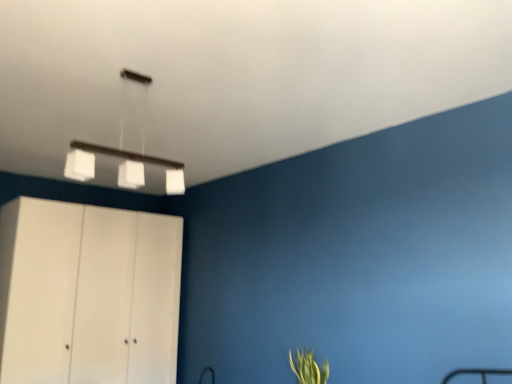
Measure the distance between point (x=169, y=183) and camera.

A distance of 2.15 meters exists between point (x=169, y=183) and camera.

This screenshot has height=384, width=512. What do you see at coordinates (88, 294) in the screenshot? I see `white matte cabinet at left` at bounding box center [88, 294].

The height and width of the screenshot is (384, 512). I want to click on green leafy plant at lower right, so click(309, 368).

Considering the sizes of objects white matte cabinet at left and white matte rectangular light fixture at upper center in the image provided, who is smaller, white matte cabinet at left or white matte rectangular light fixture at upper center?

white matte rectangular light fixture at upper center.

From the image's perspective, is white matte cabinet at left above white matte rectangular light fixture at upper center?

No, from the image's perspective, white matte cabinet at left is not above white matte rectangular light fixture at upper center.

Who is shorter, white matte cabinet at left or white matte rectangular light fixture at upper center?

white matte rectangular light fixture at upper center.

From a real-world perspective, who is located lower, white matte cabinet at left or white matte rectangular light fixture at upper center?

In real-world perspective, white matte cabinet at left is lower.

From the image's perspective, is white matte rectangular light fixture at upper center located above or below white matte cabinet at left?

white matte rectangular light fixture at upper center is situated higher than white matte cabinet at left in the image.

Which object is further away from the camera taking this photo, white matte rectangular light fixture at upper center or white matte cabinet at left?

white matte cabinet at left.

Find the location of a particular element. cupboard below the white matte rectangular light fixture at upper center (from the image's perspective) is located at coordinates (88, 294).

Would you say white matte rectangular light fixture at upper center contains white matte cabinet at left?

No, white matte rectangular light fixture at upper center does not contain white matte cabinet at left.

Is green leafy plant at lower right far from white matte cabinet at left?

Yes, green leafy plant at lower right and white matte cabinet at left are located far from each other.

What are the coordinates of `cupboard that appears above the green leafy plant at lower right (from the image's perspective)` in the screenshot? It's located at pos(88,294).

From the image's perspective, between green leafy plant at lower right and white matte cabinet at left, which one is located above?

white matte cabinet at left, from the image's perspective.

Which of these two, green leafy plant at lower right or white matte cabinet at left, is bigger?

With larger size is white matte cabinet at left.

From the image's perspective, is white matte rectangular light fixture at upper center above or below green leafy plant at lower right?

Based on their image positions, white matte rectangular light fixture at upper center is located above green leafy plant at lower right.

Is white matte rectangular light fixture at upper center to the left or to the right of green leafy plant at lower right in the image?

white matte rectangular light fixture at upper center is to the left of green leafy plant at lower right.

Between white matte rectangular light fixture at upper center and green leafy plant at lower right, which one has smaller width?

With smaller width is white matte rectangular light fixture at upper center.

Can you confirm if white matte rectangular light fixture at upper center is taller than green leafy plant at lower right?

Yes.

Can you tell me how much green leafy plant at lower right and white matte rectangular light fixture at upper center differ in facing direction?

The angular difference between green leafy plant at lower right and white matte rectangular light fixture at upper center is 95.3 degrees.

In the scene shown: From the image's perspective, is green leafy plant at lower right on top of white matte rectangular light fixture at upper center?

No.

Which of these two, green leafy plant at lower right or white matte rectangular light fixture at upper center, is bigger?

Bigger between the two is white matte rectangular light fixture at upper center.

Looking at their sizes, would you say green leafy plant at lower right is wider or thinner than white matte rectangular light fixture at upper center?

green leafy plant at lower right is wider than white matte rectangular light fixture at upper center.

I want to click on cupboard behind the green leafy plant at lower right, so click(88, 294).

From the picture: Are white matte cabinet at left and green leafy plant at lower right located far from each other?

white matte cabinet at left is far away from green leafy plant at lower right.

Considering the positions of point (49, 310) and point (313, 353), is point (49, 310) closer or farther from the camera than point (313, 353)?

Clearly, point (49, 310) is more distant from the camera than point (313, 353).

Is white matte cabinet at left located outside green leafy plant at lower right?

That's correct, white matte cabinet at left is outside of green leafy plant at lower right.

Find the location of a particular element. This screenshot has width=512, height=384. lamp on the right of white matte cabinet at left is located at coordinates (124, 154).

Where is `cupboard that appears below the white matte rectangular light fixture at upper center (from the image's perspective)`? cupboard that appears below the white matte rectangular light fixture at upper center (from the image's perspective) is located at coordinates (88, 294).

When comparing their distances from white matte cabinet at left, does white matte rectangular light fixture at upper center or green leafy plant at lower right seem further?

green leafy plant at lower right.

Which object lies further to the anchor point white matte rectangular light fixture at upper center, green leafy plant at lower right or white matte cabinet at left?

green leafy plant at lower right lies further to white matte rectangular light fixture at upper center than the other object.

Which object lies nearer to the anchor point green leafy plant at lower right, white matte rectangular light fixture at upper center or white matte cabinet at left?

The object closer to green leafy plant at lower right is white matte rectangular light fixture at upper center.

Considering their positions, is green leafy plant at lower right positioned further to white matte cabinet at left than white matte rectangular light fixture at upper center?

green leafy plant at lower right is positioned further to the anchor white matte cabinet at left.

Based on the photo, considering their positions, is white matte cabinet at left positioned closer to green leafy plant at lower right than white matte rectangular light fixture at upper center?

white matte rectangular light fixture at upper center is positioned closer to the anchor green leafy plant at lower right.

Based on their spatial positions, is white matte cabinet at left or green leafy plant at lower right further from white matte rectangular light fixture at upper center?

Based on the image, green leafy plant at lower right appears to be further to white matte rectangular light fixture at upper center.

Where is `lamp located between white matte cabinet at left and green leafy plant at lower right in the left-right direction`? The width and height of the screenshot is (512, 384). lamp located between white matte cabinet at left and green leafy plant at lower right in the left-right direction is located at coordinates (124, 154).